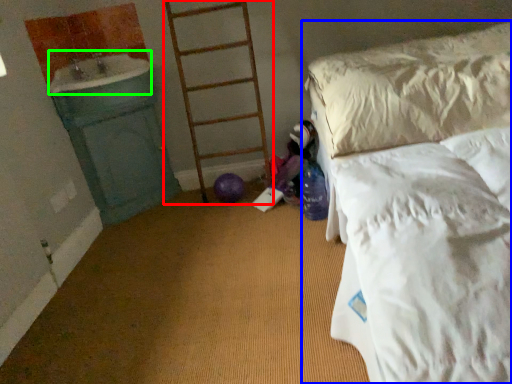
Question: Which object is positioned farthest from ladder (highlighted by a red box)? Select from bed (highlighted by a blue box) and sink (highlighted by a green box).

Choices:
 (A) bed
 (B) sink

Answer: (A)